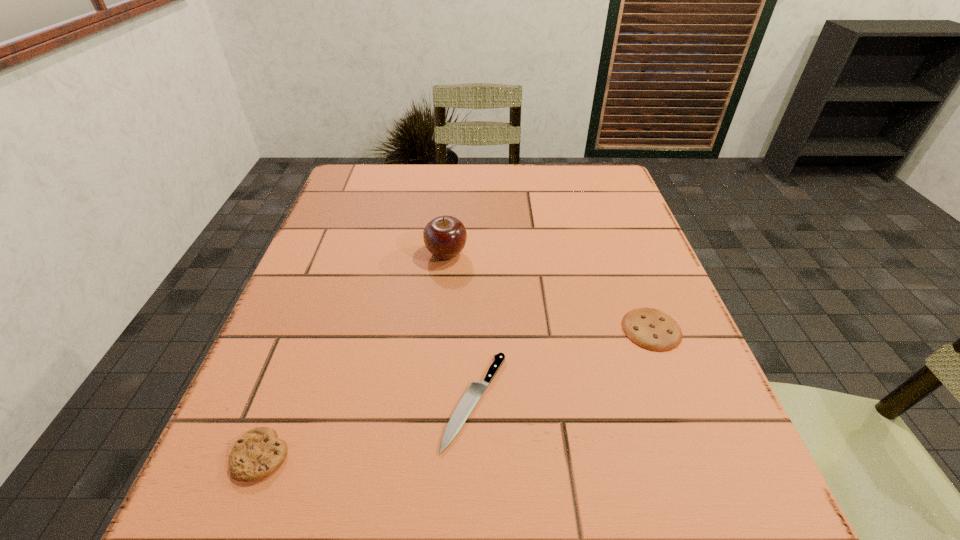
At what (x,y) coordinates should I click in order to perform the action: click on vacant position located 0.070m on the right of the shortest object. Please return your answer as a coordinate pair (x, y). Looking at the image, I should click on (551, 401).

In order to click on object that is at the near edge in this screenshot , I will do `click(258, 453)`.

Image resolution: width=960 pixels, height=540 pixels. Find the location of `object located in the left edge section of the desktop`. object located in the left edge section of the desktop is located at coordinates point(258,453).

You are a GUI agent. You are given a task and a screenshot of the screen. Output one action in this format:
    pyautogui.click(x=<x>, y=<y>)
    Task: Click on the object at the right edge
    This screenshot has width=960, height=540.
    Given the screenshot: What is the action you would take?
    pyautogui.click(x=652, y=329)

Identify the location of object situated at the near left corner. (258, 453).

You are a GUI agent. You are given a task and a screenshot of the screen. Output one action in this format:
    pyautogui.click(x=<x>, y=<y>)
    Task: Click on the vacant space at the far edge
    The image size is (960, 540).
    Given the screenshot: What is the action you would take?
    pyautogui.click(x=548, y=173)

In the image, there is a desktop. In order to click on free space at the near edge in this screenshot , I will do `click(366, 489)`.

In the image, there is a desktop. Where is `vacant space at the left edge`? vacant space at the left edge is located at coordinates (371, 266).

In the image, there is a desktop. Where is `vacant space at the right edge`? vacant space at the right edge is located at coordinates (640, 411).

This screenshot has height=540, width=960. I want to click on blank space at the far left corner of the desktop, so click(x=337, y=194).